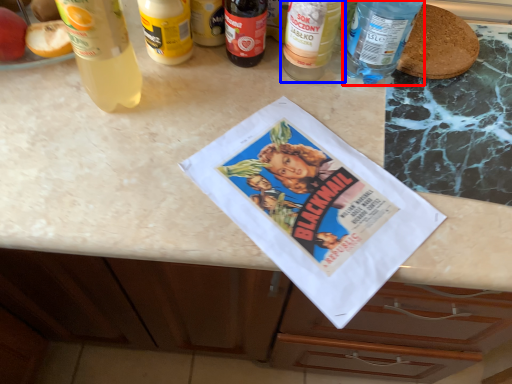
Question: Which of the following is the closest to the observer, bottle (highlighted by a red box) or bottle (highlighted by a blue box)?

Choices:
 (A) bottle
 (B) bottle

Answer: (A)